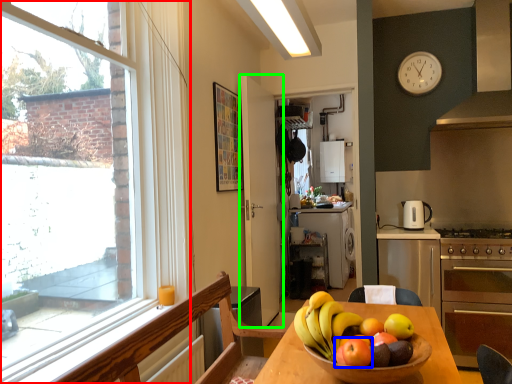
Question: Which object is the farthest from window (highlighted by a red box)? Choose among these: apple (highlighted by a blue box) or door (highlighted by a green box).

Choices:
 (A) apple
 (B) door

Answer: (A)